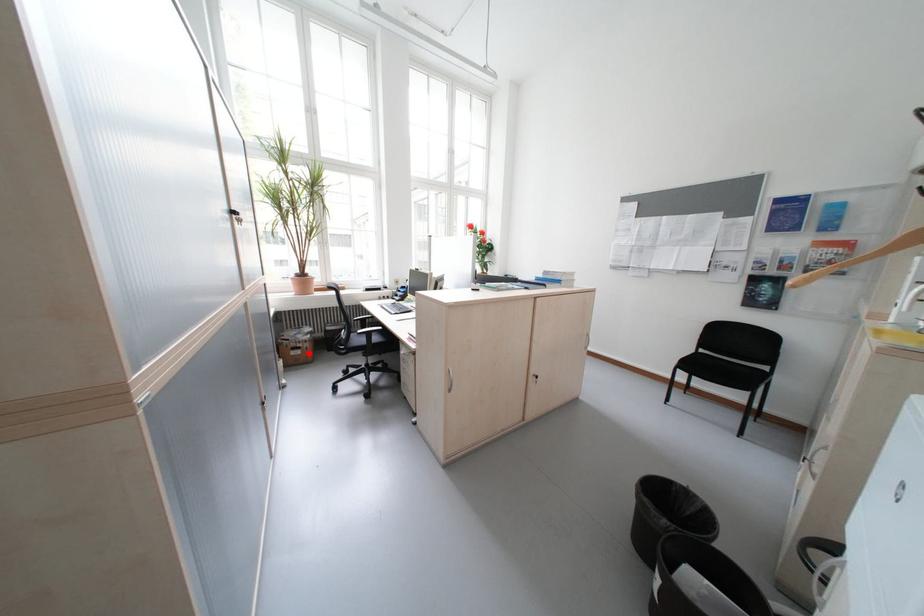
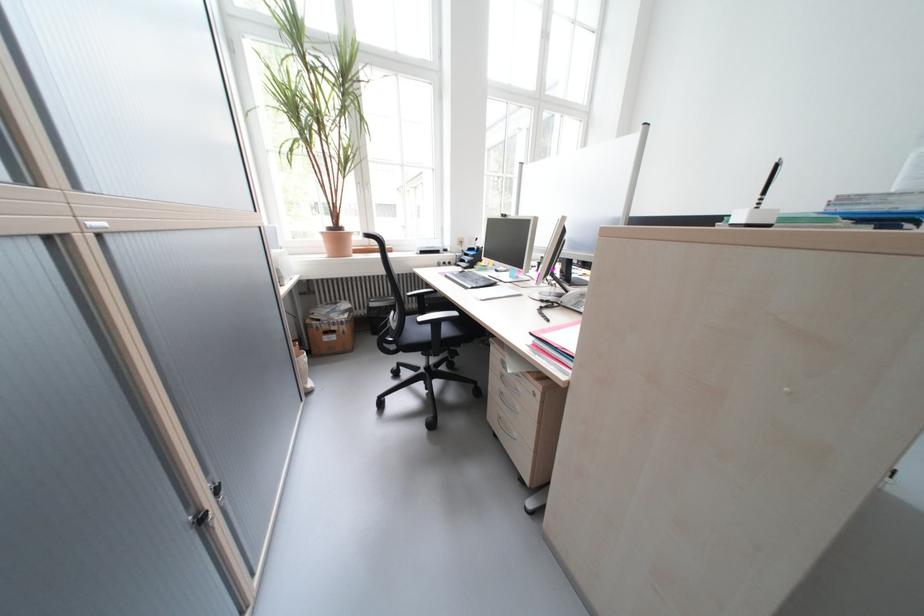
Where in the second image is the point corresponding to the highlighted location from the first image?

(344, 339)